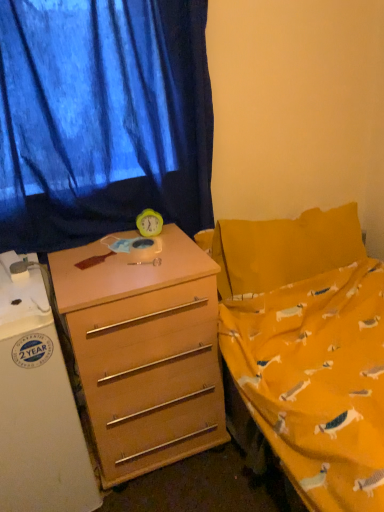
Measure the distance between point (220, 384) and camera.

Point (220, 384) and camera are 5.14 feet apart.

The height and width of the screenshot is (512, 384). What do you see at coordinates (149, 223) in the screenshot? I see `yellow plastic clock at center` at bounding box center [149, 223].

You are a GUI agent. You are given a task and a screenshot of the screen. Output one action in this format:
    pyautogui.click(x=<x>, y=<y>)
    Task: Click on the blue fabric curtain at upper left
    The width and height of the screenshot is (384, 512).
    Given the screenshot: What is the action you would take?
    pyautogui.click(x=102, y=119)

Can you tell me how much blue fabric curtain at upper left and white glossy refrigerator at left differ in facing direction?

blue fabric curtain at upper left and white glossy refrigerator at left are facing 0.791 degrees away from each other.

How distant is blue fabric curtain at upper left from white glossy refrigerator at left?

A distance of 24.17 inches exists between blue fabric curtain at upper left and white glossy refrigerator at left.

Is blue fabric curtain at upper left facing towards white glossy refrigerator at left?

No, blue fabric curtain at upper left is not facing towards white glossy refrigerator at left.

Is blue fabric curtain at upper left smaller than white glossy refrigerator at left?

Yes, blue fabric curtain at upper left is smaller than white glossy refrigerator at left.

Between point (159, 231) and point (30, 460), which one is positioned in front?

The point (30, 460) is more forward.

Considering the relative sizes of yellow plastic clock at center and white glossy refrigerator at left in the image provided, is yellow plastic clock at center thinner than white glossy refrigerator at left?

Indeed, yellow plastic clock at center has a lesser width compared to white glossy refrigerator at left.

The width and height of the screenshot is (384, 512). There is a white glossy refrigerator at left. In order to click on clock above it (from a real-world perspective) in this screenshot , I will do `click(149, 223)`.

Measure the distance between yellow plastic clock at center and white glossy refrigerator at left.

26.62 inches.

Looking at the image, does light brown wood desk at center seem bigger or smaller compared to yellow plastic clock at center?

In the image, light brown wood desk at center appears to be larger than yellow plastic clock at center.

Locate an element on the screen. The width and height of the screenshot is (384, 512). desk in front of the yellow plastic clock at center is located at coordinates (144, 351).

Is light brown wood desk at center aimed at yellow plastic clock at center?

No, light brown wood desk at center is not aimed at yellow plastic clock at center.

From the image's perspective, is light brown wood desk at center located above or below yellow plastic clock at center?

Clearly, from the image's perspective, light brown wood desk at center is below yellow plastic clock at center.

From the image's perspective, is white glossy refrigerator at left located beneath light brown wood desk at center?

Yes, from the image's perspective, white glossy refrigerator at left is below light brown wood desk at center.

Is white glossy refrigerator at left looking in the opposite direction of light brown wood desk at center?

white glossy refrigerator at left does not have its back to light brown wood desk at center.

Identify the location of desk behind the white glossy refrigerator at left. (144, 351).

Is light brown wood desk at center a part of white glossy refrigerator at left?

That's incorrect, light brown wood desk at center is not inside white glossy refrigerator at left.

Considering the sizes of light brown wood desk at center and white glossy refrigerator at left in the image, is light brown wood desk at center wider or thinner than white glossy refrigerator at left?

In the image, light brown wood desk at center appears to be more narrow than white glossy refrigerator at left.

Can you confirm if light brown wood desk at center is bigger than white glossy refrigerator at left?

Yes.

Find the location of a particular element. The image size is (384, 512). desk that appears above the white glossy refrigerator at left (from the image's perspective) is located at coordinates (144, 351).

From the image's perspective, which is above, light brown wood desk at center or white glossy refrigerator at left?

From the image's view, light brown wood desk at center is above.

Considering the relative positions of blue fabric curtain at upper left and yellow plastic clock at center in the image provided, is blue fabric curtain at upper left behind yellow plastic clock at center?

No, blue fabric curtain at upper left is closer to the viewer.

Considering the relative sizes of blue fabric curtain at upper left and yellow plastic clock at center in the image provided, is blue fabric curtain at upper left wider than yellow plastic clock at center?

Incorrect, the width of blue fabric curtain at upper left does not surpass that of yellow plastic clock at center.

Is blue fabric curtain at upper left in contact with yellow plastic clock at center?

No, blue fabric curtain at upper left is not next to yellow plastic clock at center.

Who is taller, blue fabric curtain at upper left or yellow plastic clock at center?

blue fabric curtain at upper left is taller.

Are white glossy refrigerator at left and blue fabric curtain at upper left making contact?

No, white glossy refrigerator at left is not touching blue fabric curtain at upper left.

Which object is further away from the camera taking this photo, white glossy refrigerator at left or blue fabric curtain at upper left?

blue fabric curtain at upper left is more distant.

How many degrees apart are the facing directions of white glossy refrigerator at left and blue fabric curtain at upper left?

0.791 degrees separate the facing orientations of white glossy refrigerator at left and blue fabric curtain at upper left.

Who is taller, white glossy refrigerator at left or blue fabric curtain at upper left?

Standing taller between the two is white glossy refrigerator at left.

Where is `refrigerator that is under the blue fabric curtain at upper left (from a real-world perspective)`? refrigerator that is under the blue fabric curtain at upper left (from a real-world perspective) is located at coordinates (38, 408).

This screenshot has height=512, width=384. What are the coordinates of `refrigerator in front of the yellow plastic clock at center` in the screenshot? It's located at (38, 408).

Considering their positions, is blue fabric curtain at upper left positioned closer to light brown wood desk at center than yellow plastic clock at center?

Among the two, yellow plastic clock at center is located nearer to light brown wood desk at center.

Estimate the real-world distances between objects in this image. Which object is closer to blue fabric curtain at upper left, light brown wood desk at center or yellow plastic clock at center?

yellow plastic clock at center is positioned closer to the anchor blue fabric curtain at upper left.

From the image, which object appears to be nearer to blue fabric curtain at upper left, yellow plastic clock at center or white glossy refrigerator at left?

Among the two, yellow plastic clock at center is located nearer to blue fabric curtain at upper left.

Considering their positions, is yellow plastic clock at center positioned closer to white glossy refrigerator at left than light brown wood desk at center?

light brown wood desk at center lies closer to white glossy refrigerator at left than the other object.

Looking at the image, which one is located further to white glossy refrigerator at left, blue fabric curtain at upper left or light brown wood desk at center?

Based on the image, blue fabric curtain at upper left appears to be further to white glossy refrigerator at left.

Based on their spatial positions, is yellow plastic clock at center or blue fabric curtain at upper left closer to white glossy refrigerator at left?

blue fabric curtain at upper left is positioned closer to the anchor white glossy refrigerator at left.

Estimate the real-world distances between objects in this image. Which object is further from yellow plastic clock at center, light brown wood desk at center or white glossy refrigerator at left?

Among the two, white glossy refrigerator at left is located further to yellow plastic clock at center.

From the image, which object appears to be nearer to light brown wood desk at center, yellow plastic clock at center or white glossy refrigerator at left?

The object closer to light brown wood desk at center is white glossy refrigerator at left.

The width and height of the screenshot is (384, 512). I want to click on clock between blue fabric curtain at upper left and white glossy refrigerator at left from top to bottom, so click(149, 223).

You are a GUI agent. You are given a task and a screenshot of the screen. Output one action in this format:
    pyautogui.click(x=<x>, y=<y>)
    Task: Click on the clock between blue fabric curtain at upper left and light brown wood desk at center from top to bottom
    The image size is (384, 512).
    Given the screenshot: What is the action you would take?
    pyautogui.click(x=149, y=223)

Find the location of a particular element. desk between yellow plastic clock at center and white glossy refrigerator at left from top to bottom is located at coordinates [x=144, y=351].

At what (x,y) coordinates should I click in order to perform the action: click on desk between blue fabric curtain at upper left and white glossy refrigerator at left in the up-down direction. Please return your answer as a coordinate pair (x, y). Looking at the image, I should click on (144, 351).